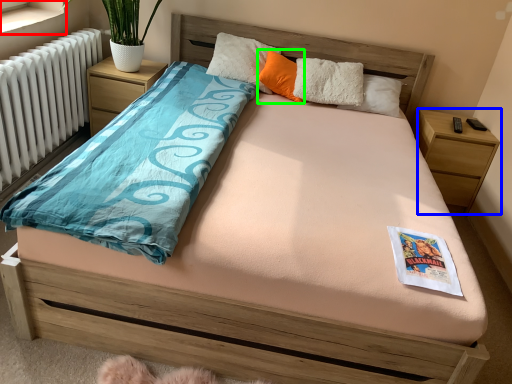
Question: Considering the real-world distances, which object is closest to window sill (highlighted by a red box)? nightstand (highlighted by a blue box) or pillow (highlighted by a green box).

Choices:
 (A) nightstand
 (B) pillow

Answer: (B)